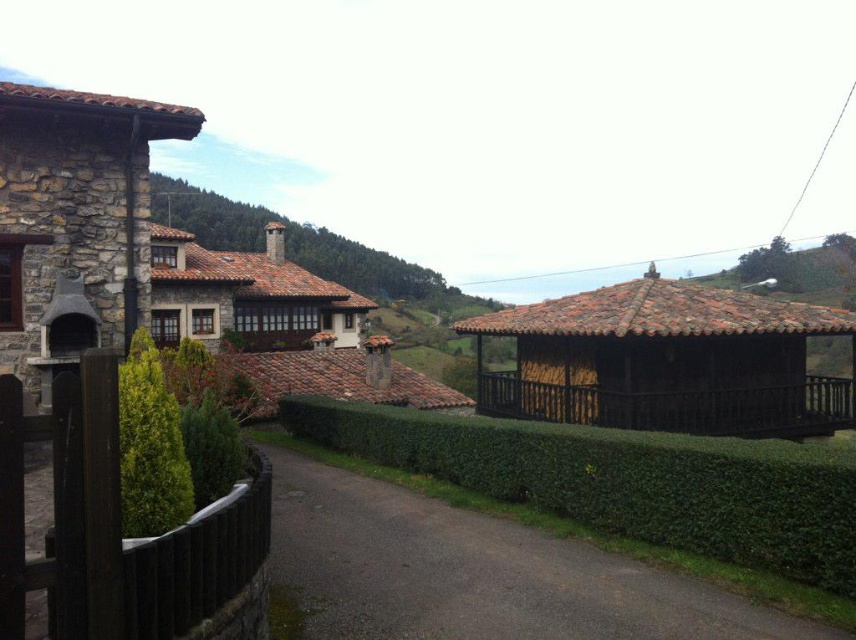
You are a gardener standing at the stone chimney at left and want to water the green leafy hedge at center. Your hose can reach up to 10 meters. Do you think you can water the hedge without moving the hose nozzle?

The stone chimney at left is 9.53 meters from the green leafy hedge at center. Since the hose can reach up to 10 meters, you can water the hedge without moving the hose nozzle as the distance is within the hose range.

In the scene shown: You are an architect designing a new garden path. You need to place a decorative stone chimney at left and a brown tiled roof at center along the path. Given the space constraints, which object requires more horizontal space due to its width?

The stone chimney at left requires more horizontal space because its width is larger than the brown tiled roof at center.